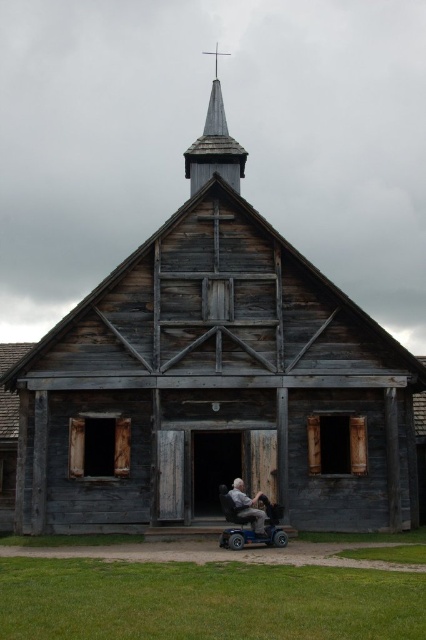
You are standing in front of the rustic wooden chapel and want to determine the relative positions of two points marked on the building. Which point is closer to you, point at position (233, 138) or point at position (273, 541)?

Point at position (273, 541) is closer to you because point at position (233, 138) is further away from the camera than point at position (273, 541).

You are a person in a wheelchair who wants to enter the church. The gray plastic wheelchair at center is positioned at the entrance. Can you safely pass under the wooden spire at upper center without hitting your head?

The wooden spire at upper center has a greater height compared to the gray plastic wheelchair at center, so there is sufficient clearance for the wheelchair to pass under it without hitting the spire.

You are standing at a distance from the rustic wooden church. You want to know if you can see the point at coordinates point (239, 172) clearly from your current position. The camera is positioned such that it can capture objects within a 30 meter range. Can you confirm if the point is within the camera range?

The distance of point (239, 172) from camera is 29.67 meters, which is within the 30 meter range. Therefore, the point is within the camera range and can be seen clearly.